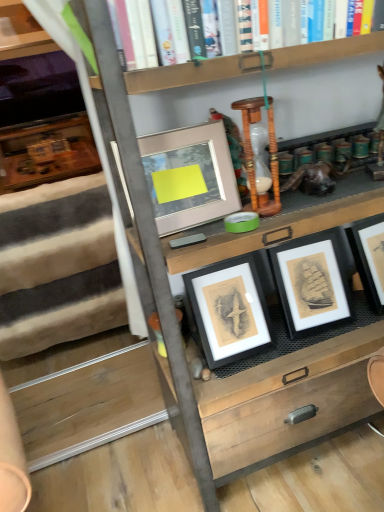
Question: Is matte gray picture frame at upper center, the first picture frame in the left-to-right sequence, positioned in front of soft woolen rug at left?

Choices:
 (A) yes
 (B) no

Answer: (A)

Question: Considering the relative sizes of matte gray picture frame at upper center, the first picture frame in the left-to-right sequence, and soft woolen rug at left in the image provided, is matte gray picture frame at upper center, the first picture frame in the left-to-right sequence, shorter than soft woolen rug at left?

Choices:
 (A) yes
 (B) no

Answer: (A)

Question: Is matte gray picture frame at upper center, which ranks as the third picture frame in right-to-left order, facing away from soft woolen rug at left?

Choices:
 (A) no
 (B) yes

Answer: (B)

Question: Considering the relative sizes of matte gray picture frame at upper center, the first picture frame in the left-to-right sequence, and soft woolen rug at left in the image provided, is matte gray picture frame at upper center, the first picture frame in the left-to-right sequence, smaller than soft woolen rug at left?

Choices:
 (A) no
 (B) yes

Answer: (B)

Question: Does matte gray picture frame at upper center, the first picture frame in the left-to-right sequence, appear on the left side of soft woolen rug at left?

Choices:
 (A) no
 (B) yes

Answer: (A)

Question: Is wooden table at center taller or shorter than matte gray picture frame at upper center, the first picture frame in the left-to-right sequence?

Choices:
 (A) tall
 (B) short

Answer: (A)

Question: Based on their sizes in the image, would you say wooden table at center is bigger or smaller than matte gray picture frame at upper center, the first picture frame in the left-to-right sequence?

Choices:
 (A) small
 (B) big

Answer: (B)

Question: Is wooden table at center wider or thinner than matte gray picture frame at upper center, the first picture frame in the left-to-right sequence?

Choices:
 (A) wide
 (B) thin

Answer: (A)

Question: From the image's perspective, is wooden table at center above or below matte gray picture frame at upper center, which ranks as the third picture frame in right-to-left order?

Choices:
 (A) below
 (B) above

Answer: (A)

Question: Would you say matte black picture frame at center, which ranks as the 2th picture frame in left-to-right order, is inside or outside matte black picture frame at center, arranged as the first picture frame when viewed from the right?

Choices:
 (A) inside
 (B) outside

Answer: (B)

Question: Looking at the image, does matte black picture frame at center, which ranks as the 2th picture frame in left-to-right order, seem bigger or smaller compared to matte black picture frame at center, which is the third picture frame in left-to-right order?

Choices:
 (A) small
 (B) big

Answer: (B)

Question: Would you say matte black picture frame at center, which is the second picture frame from right to left, is to the left or to the right of matte black picture frame at center, which is the third picture frame in left-to-right order, in the picture?

Choices:
 (A) right
 (B) left

Answer: (B)

Question: Is matte black picture frame at center, which ranks as the 2th picture frame in left-to-right order, taller or shorter than matte black picture frame at center, which is the third picture frame in left-to-right order?

Choices:
 (A) tall
 (B) short

Answer: (A)

Question: In terms of width, does matte black picture frame at center, which is the third picture frame in left-to-right order, look wider or thinner when compared to matte gray picture frame at upper center, the first picture frame in the left-to-right sequence?

Choices:
 (A) thin
 (B) wide

Answer: (B)

Question: Based on their sizes in the image, would you say matte black picture frame at center, arranged as the first picture frame when viewed from the right, is bigger or smaller than matte gray picture frame at upper center, which ranks as the third picture frame in right-to-left order?

Choices:
 (A) big
 (B) small

Answer: (A)